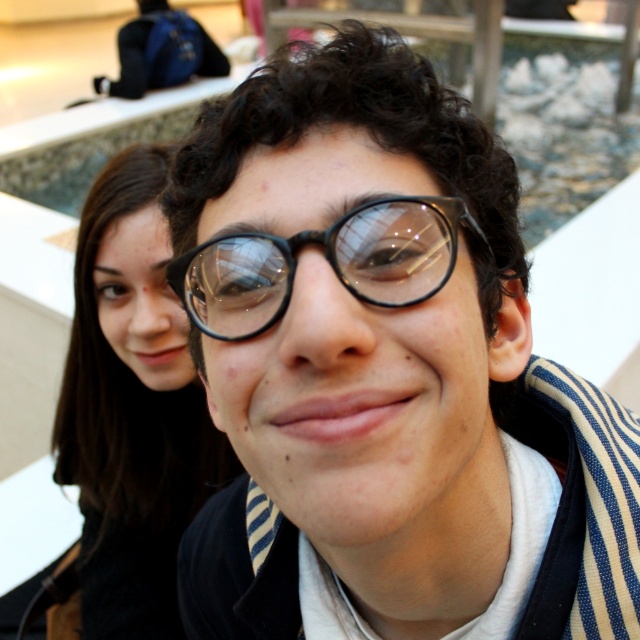
Question: Which point appears closest to the camera in this image?

Choices:
 (A) (323, 280)
 (B) (88, 417)

Answer: (A)

Question: Which point is farther to the camera?

Choices:
 (A) (97, 227)
 (B) (371, 209)
 (C) (468, 214)

Answer: (A)

Question: Can you confirm if clear plastic glasses at center is bigger than dark brown hair at left?

Choices:
 (A) yes
 (B) no

Answer: (B)

Question: Among these objects, which one is farthest from the camera?

Choices:
 (A) clear plastic glasses at center
 (B) dark brown hair at left
 (C) black matte glasses at center

Answer: (B)

Question: In this image, where is dark brown hair at left located relative to black matte glasses at center?

Choices:
 (A) below
 (B) above

Answer: (A)

Question: In this image, where is dark brown hair at left located relative to black matte glasses at center?

Choices:
 (A) below
 (B) above

Answer: (A)